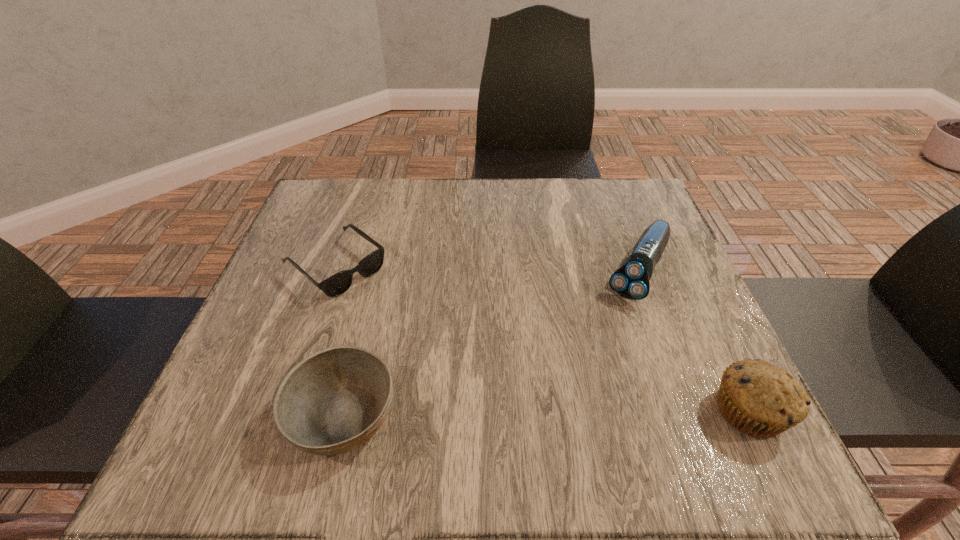
The height and width of the screenshot is (540, 960). I want to click on the second shortest object, so [333, 401].

The image size is (960, 540). I want to click on muffin, so click(x=762, y=400).

Locate an element on the screen. the shortest object is located at coordinates (337, 284).

Find the location of a particular element. The width and height of the screenshot is (960, 540). electric shaver is located at coordinates (631, 281).

Where is `free space located 0.390m on the right of the second shortest object`? free space located 0.390m on the right of the second shortest object is located at coordinates (636, 415).

This screenshot has width=960, height=540. Find the location of `free region located on the left of the muffin`. free region located on the left of the muffin is located at coordinates (657, 411).

Identify the location of vacant space positioned at the front lenses of the sunglasses. The height and width of the screenshot is (540, 960). (493, 396).

You are a GUI agent. You are given a task and a screenshot of the screen. Output one action in this format:
    pyautogui.click(x=<x>, y=<y>)
    Task: Click on the vacant position located at the front lenses of the sunglasses
    Image resolution: width=960 pixels, height=540 pixels.
    Given the screenshot: What is the action you would take?
    pyautogui.click(x=410, y=327)

The image size is (960, 540). I want to click on vacant space located at the front lenses of the sunglasses, so click(381, 303).

You are a GUI agent. You are given a task and a screenshot of the screen. Output one action in this format:
    pyautogui.click(x=<x>, y=<y>)
    Task: Click on the blank area located 0.090m on the head of the electric shaver
    
    Given the screenshot: What is the action you would take?
    pyautogui.click(x=612, y=332)